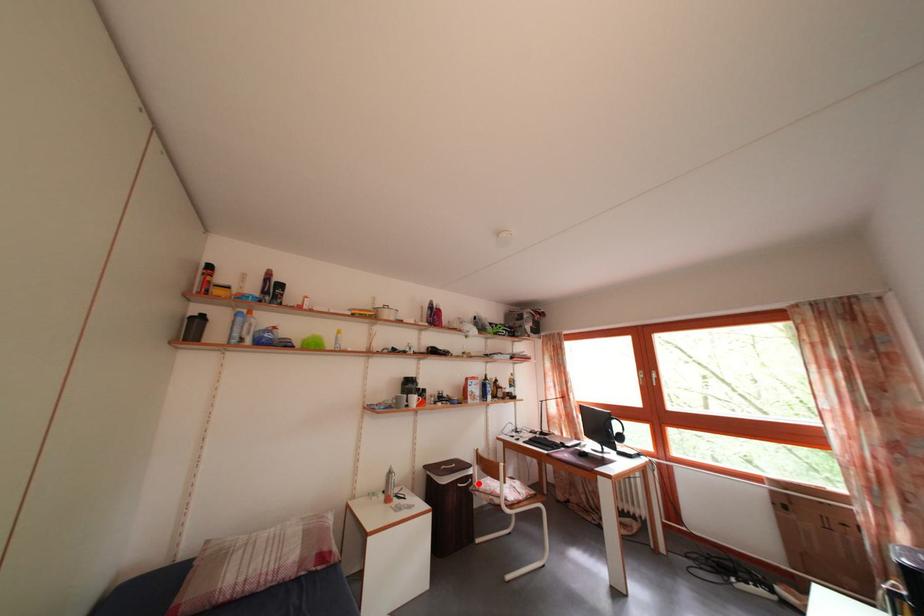
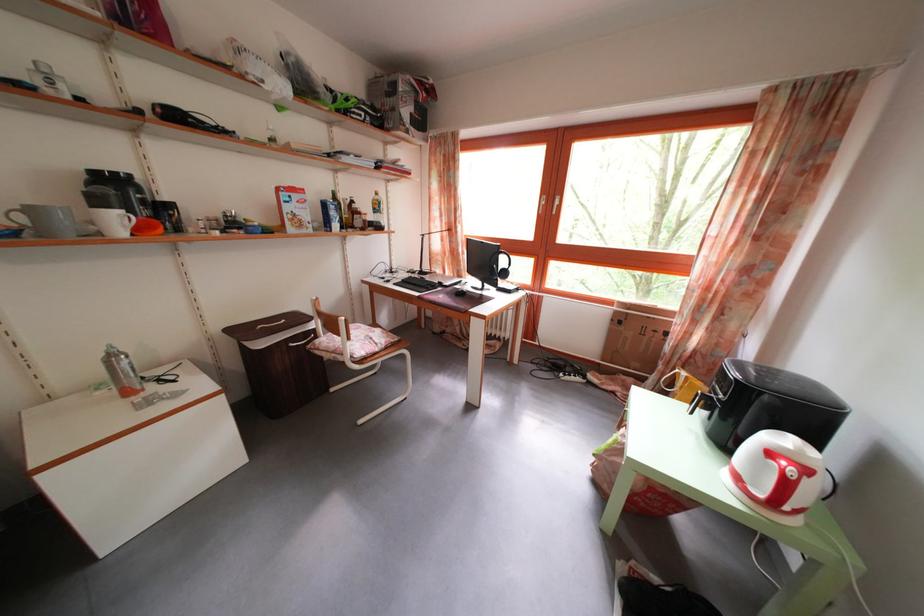
Question: I am providing you with two images of the same scene from different viewpoints. Given a red point in image1, look at the same physical point in image2. Is it:

Choices:
 (A) Closer to the viewpoint
 (B) Farther from the viewpoint

Answer: (A)